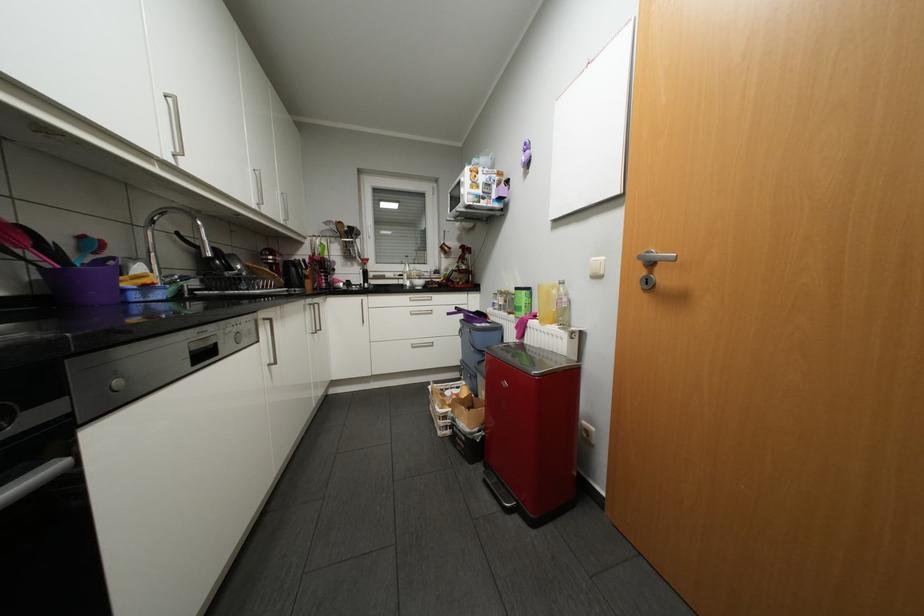
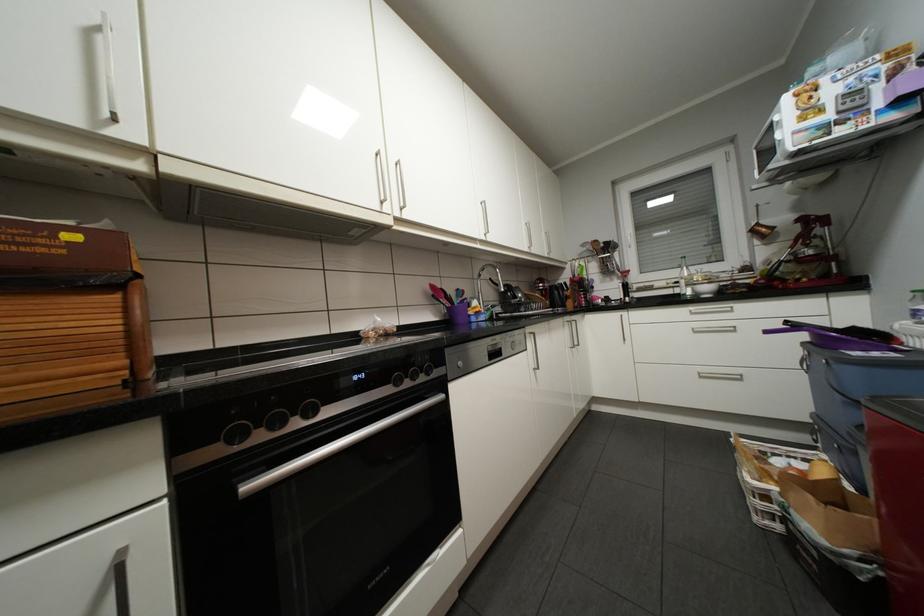
Where in the second image is the point corresponding to pixel 420 346 from the first image?

(709, 377)